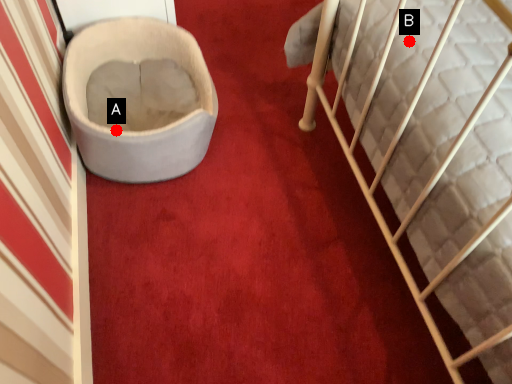
Question: Two points are circled on the image, labeled by A and B beside each circle. Which point is further to the camera?

Choices:
 (A) A is further
 (B) B is further

Answer: (A)